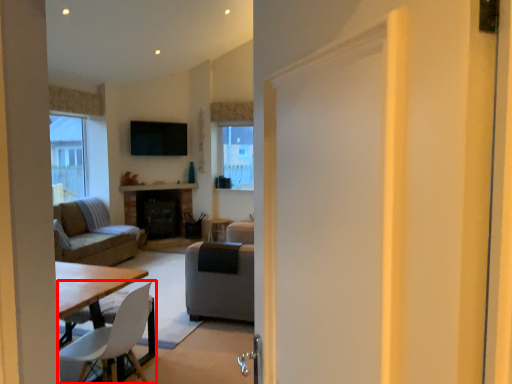
Question: From the image's perspective, what is the correct spatial relationship of chair (annotated by the red box) in relation to studio couch?

Choices:
 (A) above
 (B) below

Answer: (B)